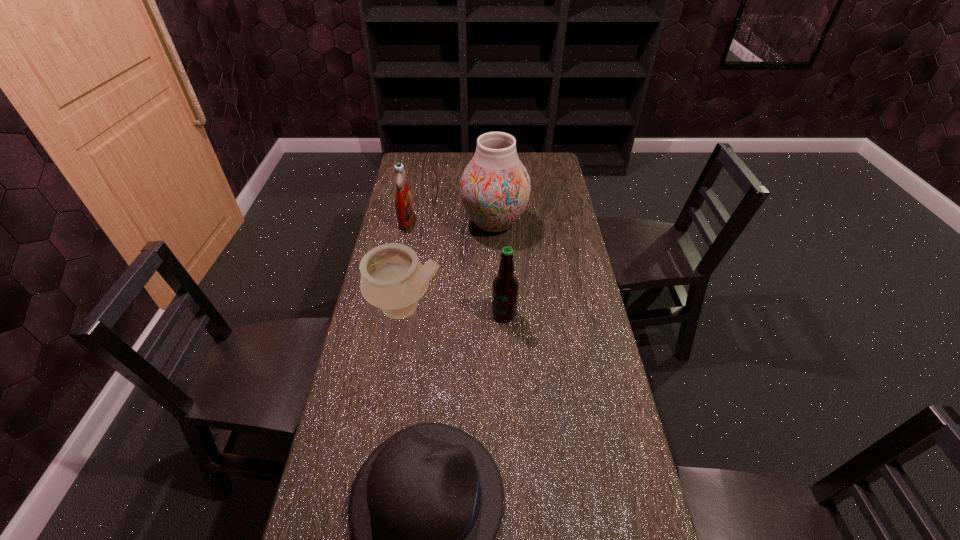
Image resolution: width=960 pixels, height=540 pixels. In order to click on the tallest object in this screenshot , I will do [x=495, y=187].

Locate an element on the screen. beer bottle is located at coordinates (505, 285).

Locate an element on the screen. This screenshot has width=960, height=540. detergent is located at coordinates (403, 199).

Find the location of a particular element. The image size is (960, 540). pottery is located at coordinates (392, 278).

The width and height of the screenshot is (960, 540). I want to click on vacant region located 0.240m on the front of the vase, so click(496, 289).

Locate an element on the screen. This screenshot has height=540, width=960. vacant space located 0.330m on the label of the beer bottle is located at coordinates (390, 314).

You are a GUI agent. You are given a task and a screenshot of the screen. Output one action in this format:
    pyautogui.click(x=<x>, y=<y>)
    Task: Click on the blank space located 0.190m on the label of the beer bottle
    
    Given the screenshot: What is the action you would take?
    pyautogui.click(x=433, y=314)

What are the coordinates of `vacant space located 0.270m on the label of the beer bottle` in the screenshot? It's located at point(408,314).

This screenshot has width=960, height=540. In order to click on vacant position located on the front surface of the detergent in this screenshot , I will do `click(467, 220)`.

Locate an element on the screen. vacant region located 0.340m on the back of the pottery is located at coordinates (420, 225).